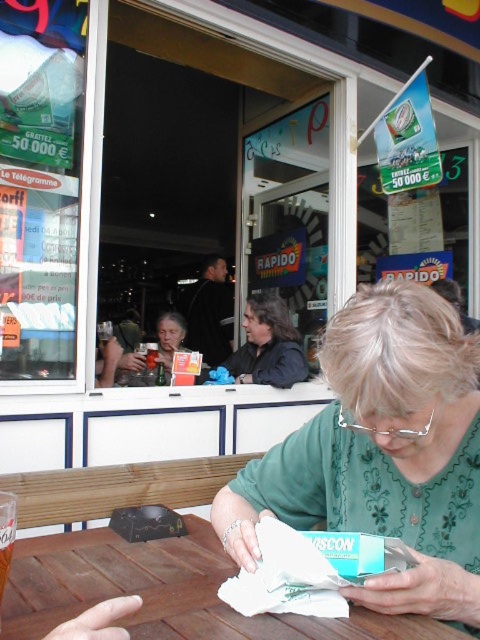
Question: Which object is farther from the camera taking this photo?

Choices:
 (A) matte plastic cup at upper left
 (B) brown wooden table at lower left

Answer: (A)

Question: Can you confirm if green fabric shirt at center is bigger than matte plastic cup at upper left?

Choices:
 (A) yes
 (B) no

Answer: (B)

Question: Does brown wooden table at lower left lie in front of dark brown leather jacket at center?

Choices:
 (A) yes
 (B) no

Answer: (A)

Question: Which of the following is the farthest from the observer?

Choices:
 (A) matte plastic cup at upper left
 (B) brown wooden table at lower left

Answer: (A)

Question: Is the position of brown wooden table at lower left more distant than that of matte plastic cup at upper left?

Choices:
 (A) yes
 (B) no

Answer: (B)

Question: Which point appears closest to the camera in this image?

Choices:
 (A) (417, 605)
 (B) (128, 369)

Answer: (A)